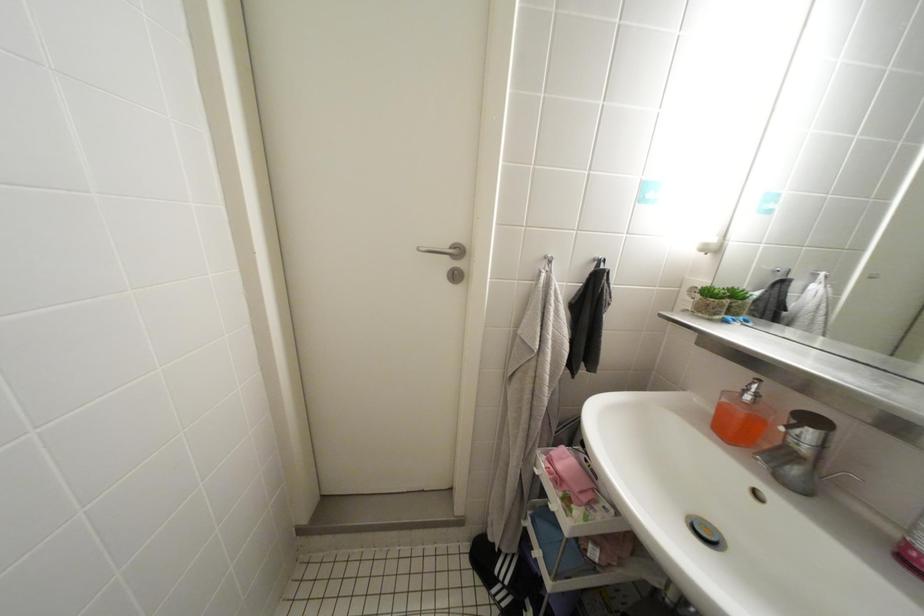
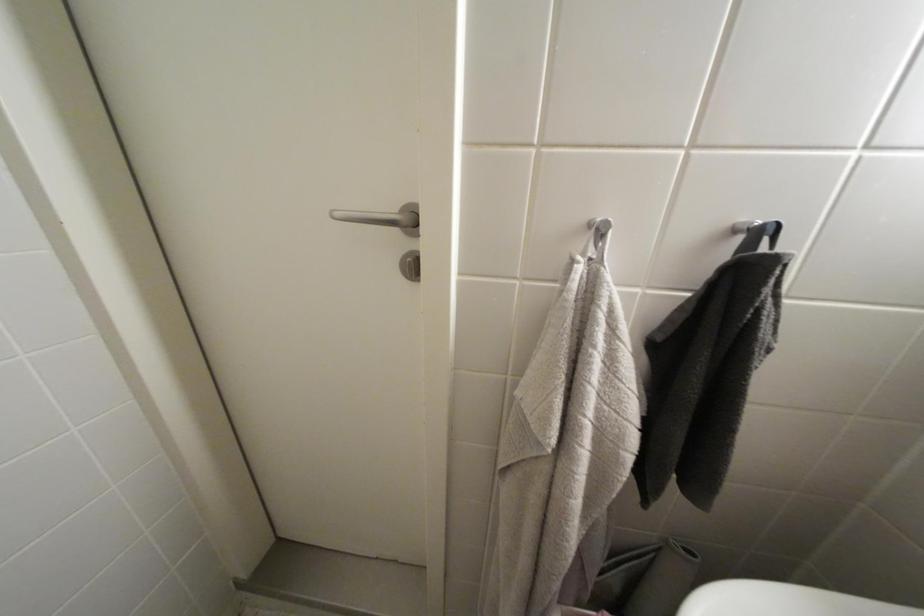
Question: Based on the continuous images, in which direction is the camera rotating? Reply with the corresponding letter.

Choices:
 (A) Left
 (B) Right
 (C) Up
 (D) Down

Answer: (A)